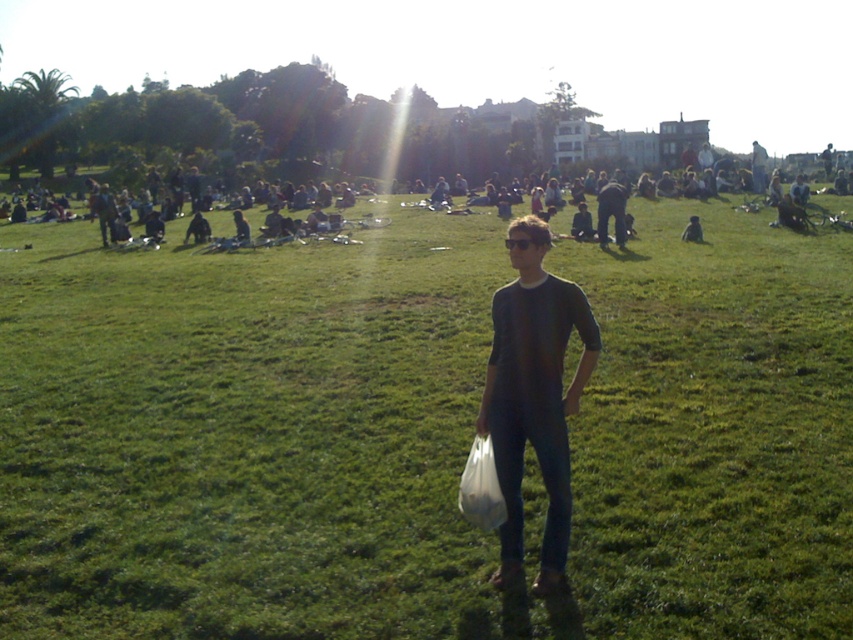
Question: Is green grassy field at center further to camera compared to dark gray shirt at center?

Choices:
 (A) yes
 (B) no

Answer: (B)

Question: Which point is farther from the camera taking this photo?

Choices:
 (A) (601, 192)
 (B) (550, 392)

Answer: (A)

Question: Does green grassy field at center appear on the left side of dark gray shirt at center?

Choices:
 (A) yes
 (B) no

Answer: (A)

Question: Which of the following is the closest to the observer?

Choices:
 (A) green grassy field at center
 (B) dark gray shirt at center
 (C) dark blue jeans at center

Answer: (A)

Question: Which of the following is the farthest from the observer?

Choices:
 (A) dark gray shirt at center
 (B) dark blue jeans at center

Answer: (B)

Question: Is green grassy field at center wider than dark gray shirt at center?

Choices:
 (A) no
 (B) yes

Answer: (B)